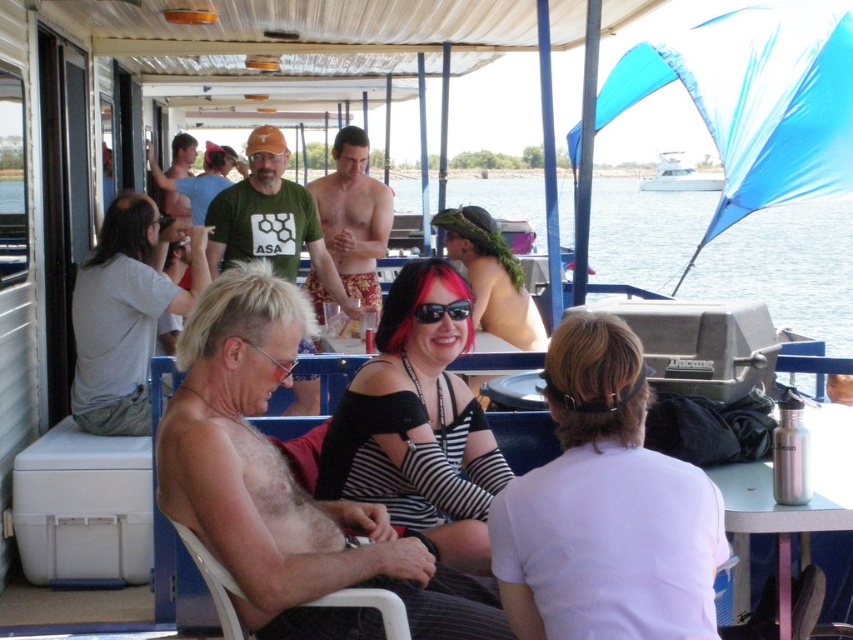
Question: Which of the following is the closest to the observer?

Choices:
 (A) (691, 188)
 (B) (167, 305)

Answer: (B)

Question: Does white cotton shirt at left have a larger size compared to yellow patterned shorts at center?

Choices:
 (A) no
 (B) yes

Answer: (A)

Question: Is shiny silver tank top at center to the left of yellow patterned shorts at center from the viewer's perspective?

Choices:
 (A) yes
 (B) no

Answer: (B)

Question: Which of the following is the farthest from the observer?

Choices:
 (A) shiny silver tank top at center
 (B) white matte shirt at center
 (C) yellow patterned shorts at center

Answer: (C)

Question: Among these objects, which one is farthest from the camera?

Choices:
 (A) white glossy boat at upper center
 (B) yellow patterned shorts at center
 (C) white matte shirt at center

Answer: (A)

Question: Does white matte shirt at center have a greater width compared to black striped shirt at center?

Choices:
 (A) yes
 (B) no

Answer: (B)